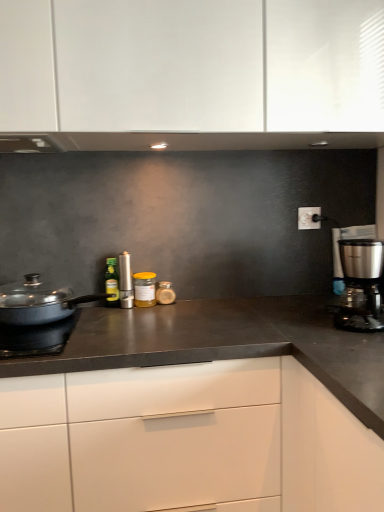
Image resolution: width=384 pixels, height=512 pixels. I want to click on vacant point to the right of yellow glass jar at center, marked as the third kitchen appliance in a right-to-left arrangement, so click(191, 305).